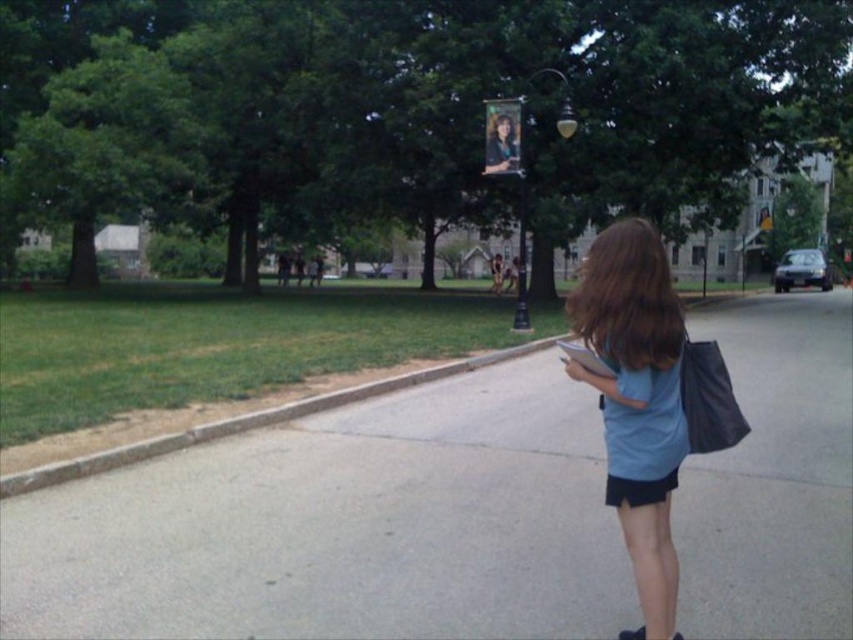
Question: Which of the following is the closest to the observer?

Choices:
 (A) (498, 120)
 (B) (503, 136)
 (C) (590, 248)
 (D) (383, 400)

Answer: (D)

Question: Does gray concrete curb at lower left appear on the left side of matte black hair at upper center?

Choices:
 (A) no
 (B) yes

Answer: (B)

Question: Does brown smooth hair at center come behind brown matte hair at upper center?

Choices:
 (A) no
 (B) yes

Answer: (A)

Question: Which object appears closest to the camera in this image?

Choices:
 (A) matte black hair at upper center
 (B) gray asphalt pavement at center

Answer: (B)

Question: Which of the following is the farthest from the observer?

Choices:
 (A) (614, 305)
 (B) (245, 480)
 (C) (607, 432)

Answer: (B)

Question: Does gray asphalt pavement at center have a smaller size compared to blue fabric shirt at center?

Choices:
 (A) no
 (B) yes

Answer: (B)